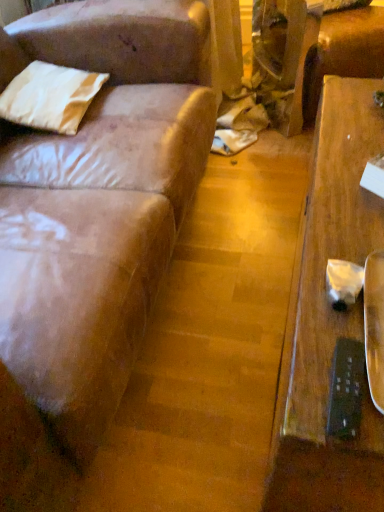
The height and width of the screenshot is (512, 384). Describe the element at coordinates (50, 97) in the screenshot. I see `white cotton pillow at upper left` at that location.

Find the location of a particular element. The image size is (384, 512). white cotton pillow at upper left is located at coordinates (50, 97).

Find the location of a particular element. The image size is (384, 512). white cotton pillow at upper left is located at coordinates (50, 97).